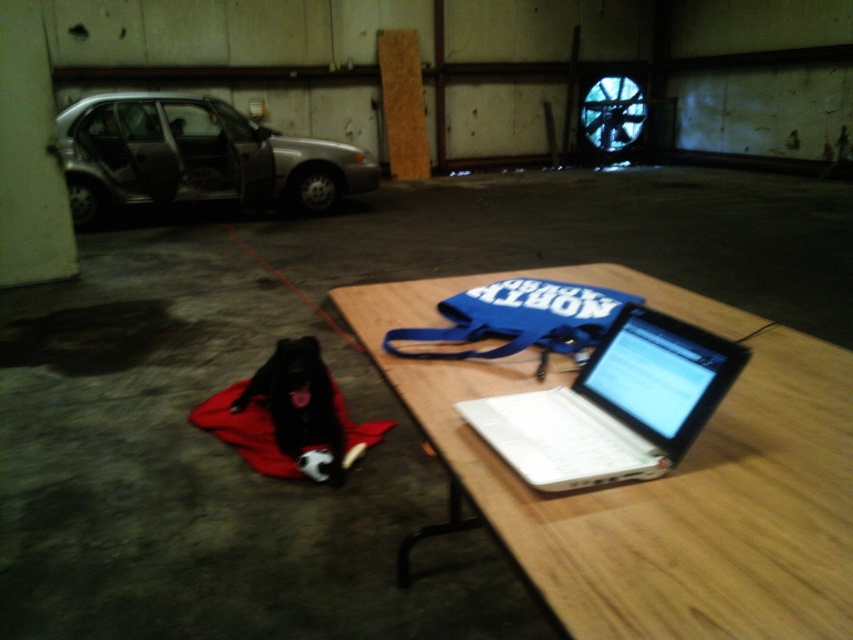
You are a delivery person who needs to park your van between the silver metallic car at left and the black fur dog at lower left. Can you fit your van, which is 2 meters wide, in the space between them?

The silver metallic car at left is wider than the black fur dog at lower left, but the description does not provide the exact distance between them. Therefore, it is impossible to determine if the van can fit based on the given information.

From the picture: You are organizing a space in the garage and need to place the white plastic laptop at center and the silver metallic car at left on a shelf. The shelf can only hold items narrower than 1 meter. Which item can fit on the shelf?

The white plastic laptop at center can fit on the shelf since its width is less than 1 meter, while the silver metallic car at left is wider and cannot fit.